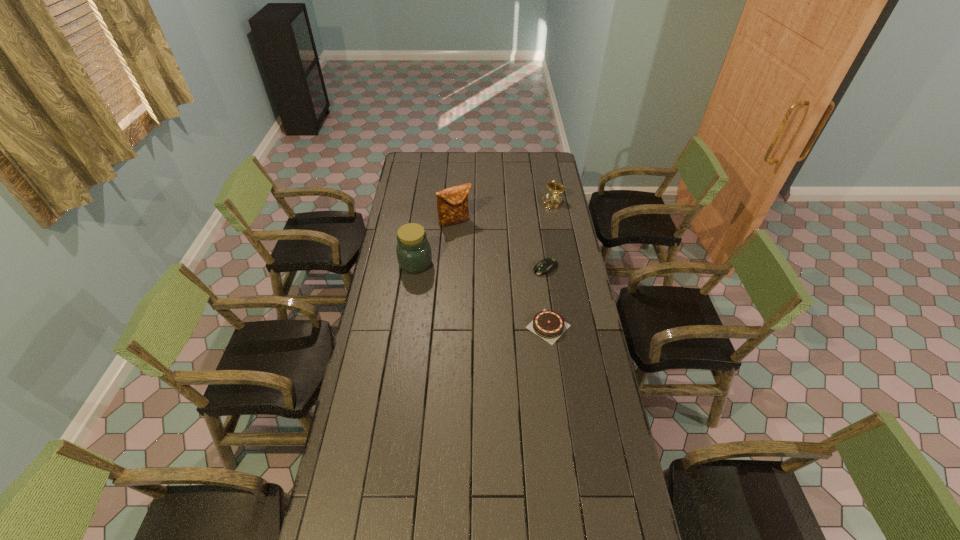
Locate an element on the screen. This screenshot has height=540, width=960. empty location between the fourth nearest object and the third tallest object is located at coordinates (504, 212).

Where is `free space between the farthest object and the clutch bag`? free space between the farthest object and the clutch bag is located at coordinates [x=504, y=212].

I want to click on vacant space that is in between the chocolate cake and the second object from left to right, so click(x=502, y=274).

Locate an element on the screen. free space between the computer mouse and the nearest object is located at coordinates (547, 298).

Locate an element on the screen. vacant space that's between the jar and the computer mouse is located at coordinates (481, 266).

At what (x,y) coordinates should I click in order to perform the action: click on vacant area that lies between the nearest object and the jar. Please return your answer as a coordinate pair (x, y). The height and width of the screenshot is (540, 960). Looking at the image, I should click on (482, 295).

Identify which object is located as the nearest to the computer mouse. Please provide its 2D coordinates. Your answer should be formatted as a tuple, i.e. [(x, y)], where the tuple contains the x and y coordinates of a point satisfying the conditions above.

[(549, 325)]

Locate an element on the screen. object that is the fourth closest one to the third shortest object is located at coordinates (549, 325).

The image size is (960, 540). In order to click on vacant space that satisfies the following two spatial constraints: 1. on the back side of the compass; 2. on the left side of the computer mouse in this screenshot , I will do `click(536, 203)`.

Where is `free space that satisfies the following two spatial constraints: 1. on the front side of the computer mouse; 2. on the right side of the jar`? This screenshot has height=540, width=960. free space that satisfies the following two spatial constraints: 1. on the front side of the computer mouse; 2. on the right side of the jar is located at coordinates (415, 268).